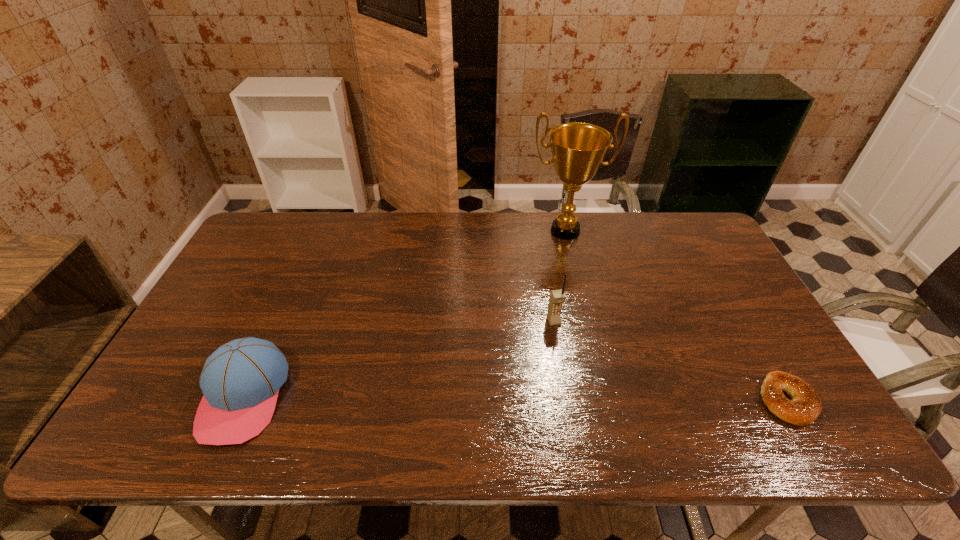
At what (x,y) coordinates should I click in order to perform the action: click on free region located on the front of the third nearest object, where the keypad is located. Please return your answer as a coordinate pair (x, y). The height and width of the screenshot is (540, 960). Looking at the image, I should click on (585, 402).

I want to click on vacant area situated 0.110m on the front of the third nearest object, where the keypad is located, so click(x=568, y=359).

Where is `vacant space located 0.080m on the front view with handles of the award`? The width and height of the screenshot is (960, 540). vacant space located 0.080m on the front view with handles of the award is located at coordinates (571, 264).

Identify the location of blank space located 0.150m on the front view with handles of the award. Image resolution: width=960 pixels, height=540 pixels. (573, 279).

Locate an element on the screen. The width and height of the screenshot is (960, 540). free location located 0.150m on the front view with handles of the award is located at coordinates (573, 279).

You are a GUI agent. You are given a task and a screenshot of the screen. Output one action in this format:
    pyautogui.click(x=<x>, y=<y>)
    Task: Click on the object located in the far edge section of the desktop
    
    Given the screenshot: What is the action you would take?
    point(578,149)

The height and width of the screenshot is (540, 960). I want to click on baseball cap positioned at the near edge, so click(x=240, y=381).

Identify the location of bagel that is at the near edge. (804, 408).

Locate an element on the screen. This screenshot has width=960, height=540. object that is at the left edge is located at coordinates (240, 381).

Locate an element on the screen. The height and width of the screenshot is (540, 960). object located in the right edge section of the desktop is located at coordinates (804, 408).